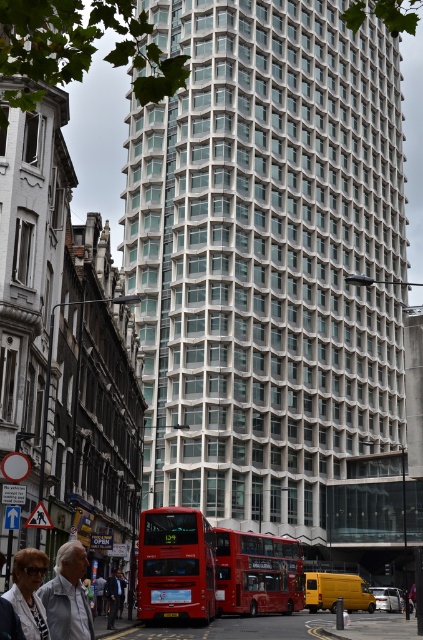
You are standing at the point with coordinates (x=258, y=573) in the urban street scene. What object are you directly facing?

The point (x=258, y=573) corresponds to the matte red bus at center, so you are directly facing the matte red bus at center.

You are standing at the point marked by the coordinates point (68, 595). Looking towards the white fabric jacket at lower left, which direction should you move to reach the red double decker bus near the center?

The point (68, 595) represents the white fabric jacket at lower left. To reach the red double decker bus near the center, you should move towards the center of the image from the lower left position of the jacket.